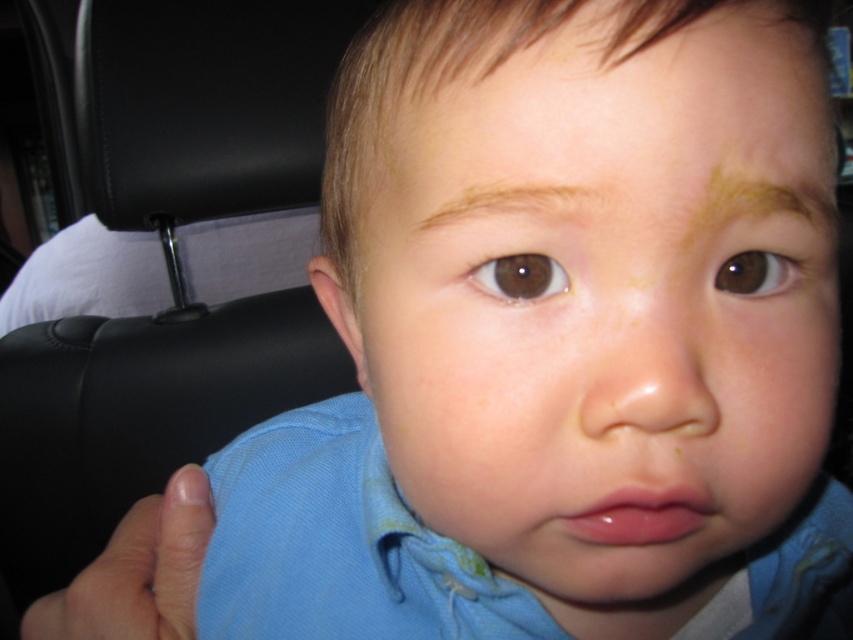
Question: Is brown smooth eyebrow at upper center below brown matte eye at center?

Choices:
 (A) yes
 (B) no

Answer: (B)

Question: Which of these objects is positioned farthest from the brown matte eye at upper right?

Choices:
 (A) brown smooth eyebrow at upper center
 (B) smooth skin face at center

Answer: (B)

Question: Based on their relative distances, which object is farther from the smooth skin face at center?

Choices:
 (A) smooth skin nose at center
 (B) light brown skin at upper center
 (C) brown smooth eyebrow at upper center
 (D) brown matte eye at upper right

Answer: (D)

Question: Which point appears closest to the camera in this image?

Choices:
 (A) (740, 163)
 (B) (650, 4)
 (C) (734, 508)
 (D) (740, 269)

Answer: (B)

Question: Is light brown skin at upper center to the right of brown smooth eyebrow at upper center from the viewer's perspective?

Choices:
 (A) yes
 (B) no

Answer: (A)

Question: Where is light brown skin at upper center located in relation to brown matte eye at center in the image?

Choices:
 (A) right
 (B) left

Answer: (A)